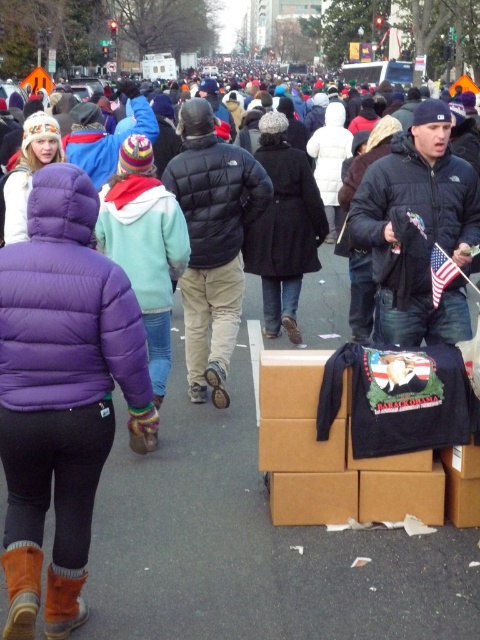
Question: Which point is closer to the camera?

Choices:
 (A) (441, 292)
 (B) (272, 394)
 (C) (442, 324)

Answer: (B)

Question: Does black puffy jacket at center have a larger size compared to american flag at center?

Choices:
 (A) no
 (B) yes

Answer: (B)

Question: Among these objects, which one is nearest to the camera?

Choices:
 (A) black puffy jacket at center
 (B) brown cardboard boxes at lower right
 (C) american flag at center

Answer: (B)

Question: Is black puffy jacket at center above american flag at center?

Choices:
 (A) no
 (B) yes

Answer: (B)

Question: Which point is closer to the camera?

Choices:
 (A) (412, 390)
 (B) (9, 592)
 (C) (240, 260)
 (D) (440, 257)

Answer: (B)

Question: In this image, where is purple puffy jacket at left located relative to american flag at center?

Choices:
 (A) below
 (B) above

Answer: (A)